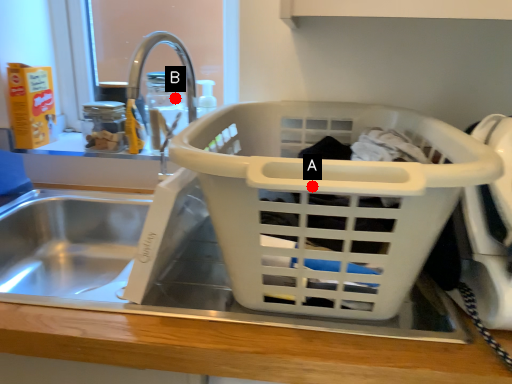
Question: Two points are circled on the image, labeled by A and B beside each circle. Which point is farther from the camera taking this photo?

Choices:
 (A) A is further
 (B) B is further

Answer: (B)